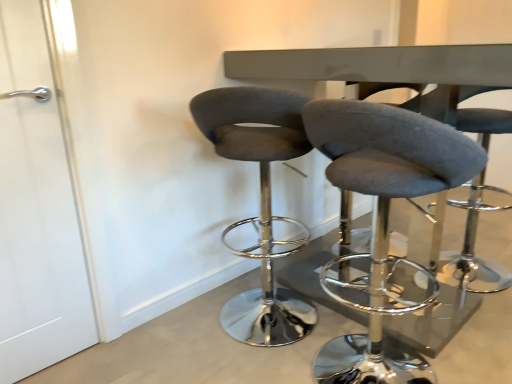
Where is `white matte door at left`? This screenshot has height=384, width=512. white matte door at left is located at coordinates (36, 209).

This screenshot has height=384, width=512. What do you see at coordinates (383, 219) in the screenshot?
I see `gray fabric stool at center, positioned as the 2th chair in right-to-left order` at bounding box center [383, 219].

The height and width of the screenshot is (384, 512). I want to click on velvet grey stool at center, positioned as the third chair in right-to-left order, so click(x=260, y=203).

Is velvet grey stool at center, marked as the first chair in a left-to-right arrangement, wider or thinner than white matte door at left?

velvet grey stool at center, marked as the first chair in a left-to-right arrangement, is wider than white matte door at left.

Based on the photo, is velvet grey stool at center, positioned as the third chair in right-to-left order, smaller than white matte door at left?

Incorrect, velvet grey stool at center, positioned as the third chair in right-to-left order, is not smaller in size than white matte door at left.

Locate an element on the screen. This screenshot has width=512, height=384. screen door that is above the velvet grey stool at center, positioned as the third chair in right-to-left order (from a real-world perspective) is located at coordinates (36, 209).

Considering the positions of objects velvet grey stool at center, positioned as the third chair in right-to-left order, and white matte door at left in the image provided, who is in front, velvet grey stool at center, positioned as the third chair in right-to-left order, or white matte door at left?

white matte door at left is in front.

Is gray fabric stool at center, positioned as the 2th chair in right-to-left order, not near metallic gray table at center?

They are positioned close to each other.

From a real-world perspective, relative to metallic gray table at center, is gray fabric stool at center, positioned as the 2th chair in right-to-left order, vertically above or below?

Clearly, from a real-world perspective, gray fabric stool at center, positioned as the 2th chair in right-to-left order, is below metallic gray table at center.

Which is behind, gray fabric stool at center, the second chair when ordered from left to right, or metallic gray table at center?

metallic gray table at center is behind.

Does point (415, 117) come farther from viewer compared to point (392, 70)?

No, (415, 117) is closer to viewer.

Based on the photo, from a real-world perspective, between white matte door at left and metallic gray table at center, who is vertically lower?

From a 3D spatial view, metallic gray table at center is below.

Considering the positions of objects white matte door at left and metallic gray table at center in the image provided, who is behind, white matte door at left or metallic gray table at center?

white matte door at left is behind.

Identify the location of screen door lying on the left of metallic gray table at center. point(36,209).

Would you say white matte door at left is to the left or to the right of metallic gray table at center in the picture?

white matte door at left is positioned on metallic gray table at center's left side.

Does velvet grey stool at center, which is the 1th chair in right-to-left order, come behind white matte door at left?

Yes, it is.

From the image's perspective, is velvet grey stool at center, which is the 1th chair in right-to-left order, located beneath white matte door at left?

No, from the image's perspective, velvet grey stool at center, which is the 1th chair in right-to-left order, is not beneath white matte door at left.

From a real-world perspective, which object stands above the other?

From a 3D spatial view, white matte door at left is above.

Is velvet grey stool at center, which is the 3th chair from left to right, facing away from white matte door at left?

velvet grey stool at center, which is the 3th chair from left to right, is not turned away from white matte door at left.

Does white matte door at left have a lesser width compared to gray fabric stool at center, the second chair when ordered from left to right?

Yes, white matte door at left is thinner than gray fabric stool at center, the second chair when ordered from left to right.

Is point (72, 250) behind point (347, 255)?

That is False.

Measure the distance from white matte door at left to gray fabric stool at center, the second chair when ordered from left to right.

The distance of white matte door at left from gray fabric stool at center, the second chair when ordered from left to right, is 3.99 feet.

From their relative heights in the image, would you say white matte door at left is taller or shorter than gray fabric stool at center, the second chair when ordered from left to right?

Clearly, white matte door at left is taller compared to gray fabric stool at center, the second chair when ordered from left to right.

From a real-world perspective, is metallic gray table at center above or below white matte door at left?

metallic gray table at center is situated lower than white matte door at left in the real world.

Is metallic gray table at center facing towards white matte door at left?

No.

How many degrees apart are the facing directions of metallic gray table at center and white matte door at left?

There is a 1.37-degree angle between the facing directions of metallic gray table at center and white matte door at left.

Is metallic gray table at center with white matte door at left?

metallic gray table at center is not next to white matte door at left, and they're not touching.

Can you confirm if gray fabric stool at center, the second chair when ordered from left to right, is positioned to the right of velvet grey stool at center, positioned as the third chair in right-to-left order?

Indeed, gray fabric stool at center, the second chair when ordered from left to right, is positioned on the right side of velvet grey stool at center, positioned as the third chair in right-to-left order.

Is gray fabric stool at center, positioned as the 2th chair in right-to-left order, wider than velvet grey stool at center, marked as the first chair in a left-to-right arrangement?

No, gray fabric stool at center, positioned as the 2th chair in right-to-left order, is not wider than velvet grey stool at center, marked as the first chair in a left-to-right arrangement.

From the image's perspective, relative to velvet grey stool at center, marked as the first chair in a left-to-right arrangement, is gray fabric stool at center, positioned as the 2th chair in right-to-left order, above or below?

Based on their image positions, gray fabric stool at center, positioned as the 2th chair in right-to-left order, is located beneath velvet grey stool at center, marked as the first chair in a left-to-right arrangement.

From the picture: In terms of height, does gray fabric stool at center, positioned as the 2th chair in right-to-left order, look taller or shorter compared to velvet grey stool at center, marked as the first chair in a left-to-right arrangement?

Clearly, gray fabric stool at center, positioned as the 2th chair in right-to-left order, is shorter compared to velvet grey stool at center, marked as the first chair in a left-to-right arrangement.

Locate an element on the screen. the 1st chair behind the white matte door at left is located at coordinates (260, 203).

From the image's perspective, count 3rd chairs downward from the metallic gray table at center and point to it. Please provide its 2D coordinates.

[(383, 219)]

Which object lies nearer to the anchor point metallic gray table at center, velvet grey stool at center, positioned as the third chair in right-to-left order, or velvet grey stool at center, which is the 1th chair in right-to-left order?

Based on the image, velvet grey stool at center, positioned as the third chair in right-to-left order, appears to be nearer to metallic gray table at center.

Based on their spatial positions, is velvet grey stool at center, which is the 3th chair from left to right, or velvet grey stool at center, positioned as the third chair in right-to-left order, further from gray fabric stool at center, the second chair when ordered from left to right?

velvet grey stool at center, which is the 3th chair from left to right.

Estimate the real-world distances between objects in this image. Which object is closer to velvet grey stool at center, marked as the first chair in a left-to-right arrangement, velvet grey stool at center, which is the 1th chair in right-to-left order, or metallic gray table at center?

metallic gray table at center is positioned closer to the anchor velvet grey stool at center, marked as the first chair in a left-to-right arrangement.

Considering their positions, is gray fabric stool at center, positioned as the 2th chair in right-to-left order, positioned closer to white matte door at left than metallic gray table at center?

Based on the image, metallic gray table at center appears to be nearer to white matte door at left.

Looking at the image, which one is located closer to white matte door at left, velvet grey stool at center, marked as the first chair in a left-to-right arrangement, or velvet grey stool at center, which is the 1th chair in right-to-left order?

velvet grey stool at center, marked as the first chair in a left-to-right arrangement, is positioned closer to the anchor white matte door at left.

Which object lies nearer to the anchor point gray fabric stool at center, positioned as the 2th chair in right-to-left order, metallic gray table at center or white matte door at left?

metallic gray table at center is positioned closer to the anchor gray fabric stool at center, positioned as the 2th chair in right-to-left order.

Based on their spatial positions, is gray fabric stool at center, the second chair when ordered from left to right, or velvet grey stool at center, positioned as the third chair in right-to-left order, further from white matte door at left?

Among the two, gray fabric stool at center, the second chair when ordered from left to right, is located further to white matte door at left.

When comparing their distances from gray fabric stool at center, positioned as the 2th chair in right-to-left order, does velvet grey stool at center, positioned as the third chair in right-to-left order, or metallic gray table at center seem closer?

Among the two, velvet grey stool at center, positioned as the third chair in right-to-left order, is located nearer to gray fabric stool at center, positioned as the 2th chair in right-to-left order.

Where is `chair located between velvet grey stool at center, marked as the first chair in a left-to-right arrangement, and metallic gray table at center in the left-right direction`? chair located between velvet grey stool at center, marked as the first chair in a left-to-right arrangement, and metallic gray table at center in the left-right direction is located at coordinates (383, 219).

Image resolution: width=512 pixels, height=384 pixels. Identify the location of chair located between white matte door at left and gray fabric stool at center, the second chair when ordered from left to right, in the left-right direction. (260, 203).

This screenshot has height=384, width=512. What are the coordinates of `round table located between velvet grey stool at center, positioned as the third chair in right-to-left order, and velvet grey stool at center, which is the 1th chair in right-to-left order, in the left-right direction` in the screenshot? It's located at (384, 68).

Identify the location of chair located between velvet grey stool at center, positioned as the third chair in right-to-left order, and velvet grey stool at center, which is the 3th chair from left to right, in the left-right direction. (383, 219).